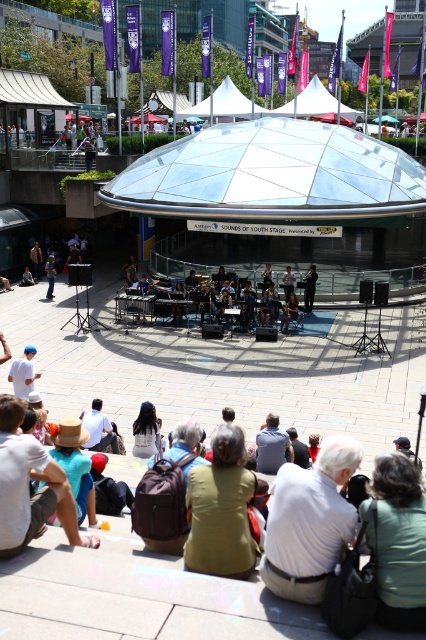
Can you confirm if transparent glass dome at center is positioned below dark blue shirt at center?

Incorrect, transparent glass dome at center is not positioned below dark blue shirt at center.

Can you confirm if transparent glass dome at center is positioned to the left of dark blue shirt at center?

Yes, transparent glass dome at center is to the left of dark blue shirt at center.

Where is `transparent glass dome at center`? The width and height of the screenshot is (426, 640). transparent glass dome at center is located at coordinates (273, 177).

Is white cotton shirt at lower center to the left of dark blue shirt at center from the viewer's perspective?

Indeed, white cotton shirt at lower center is positioned on the left side of dark blue shirt at center.

Who is more distant from viewer, (x=342, y=536) or (x=307, y=284)?

The point (x=307, y=284) is more distant.

Is point (287, 541) farther from viewer compared to point (310, 298)?

No, (287, 541) is in front of (310, 298).

Where is `white cotton shirt at lower center`? The image size is (426, 640). white cotton shirt at lower center is located at coordinates (308, 522).

Is the position of green fabric jacket at lower center more distant than that of denim jacket at lower left?

That is False.

What do you see at coordinates (221, 509) in the screenshot?
I see `green fabric jacket at lower center` at bounding box center [221, 509].

At what (x,y) coordinates should I click in order to perform the action: click on green fabric jacket at lower center. Please return your answer as a coordinate pair (x, y). The width and height of the screenshot is (426, 640). Looking at the image, I should click on (221, 509).